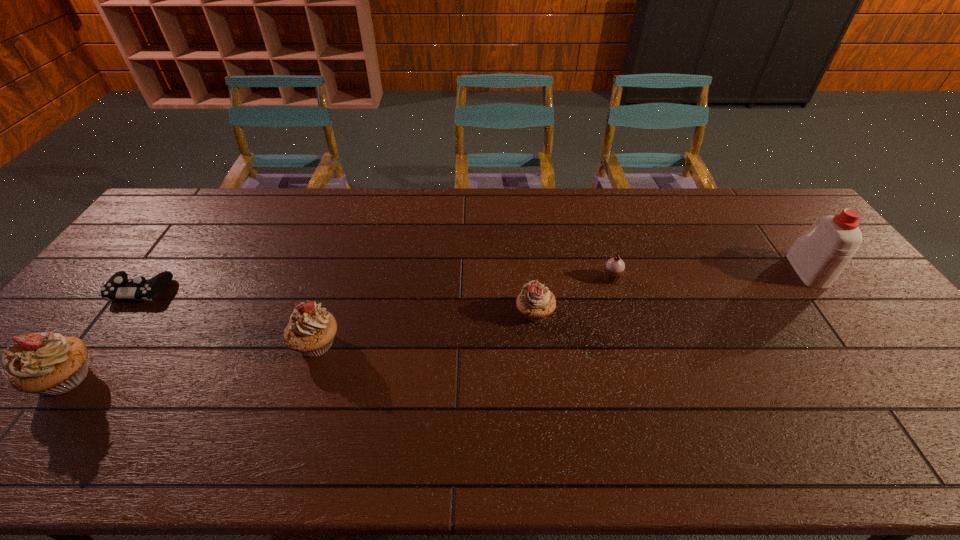
You are a GUI agent. You are given a task and a screenshot of the screen. Output one action in this format:
    pyautogui.click(x=<x>, y=<y>)
    Task: Click on the vacant region that satisfies the following two spatial constraints: 1. on the surface of the third shortest cupcake; 2. on the right side of the shortest object
    This screenshot has height=540, width=960.
    Given the screenshot: What is the action you would take?
    pyautogui.click(x=100, y=343)

Locate an element on the screen. This screenshot has width=960, height=540. free location that satisfies the following two spatial constraints: 1. on the back side of the third cupcake from right to left; 2. on the left side of the leftmost cupcake is located at coordinates (93, 343).

Find the location of a particular element. This screenshot has height=540, width=960. vacant space that satisfies the following two spatial constraints: 1. on the back side of the third shortest object; 2. on the right side of the leftmost cupcake is located at coordinates (116, 313).